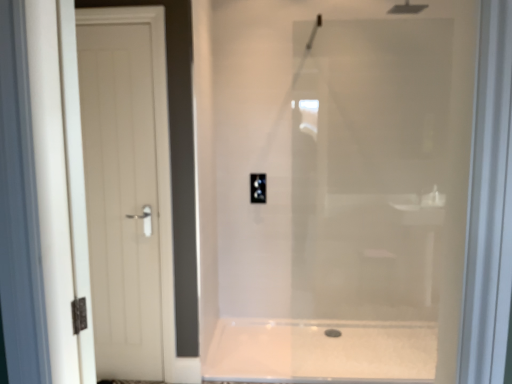
Question: In terms of width, does white glossy bath at center look wider or thinner when compared to white matte door at left?

Choices:
 (A) wide
 (B) thin

Answer: (A)

Question: Considering their positions, is white glossy bath at center located in front of or behind white matte door at left?

Choices:
 (A) behind
 (B) front

Answer: (A)

Question: Which is nearer to the black plastic outlet at center?

Choices:
 (A) black rubber drain at lower center
 (B) white glossy bath at center
 (C) white matte door at left

Answer: (C)

Question: Estimate the real-world distances between objects in this image. Which object is farther from the white matte door at left?

Choices:
 (A) black rubber drain at lower center
 (B) white glossy bath at center
 (C) black plastic outlet at center

Answer: (A)